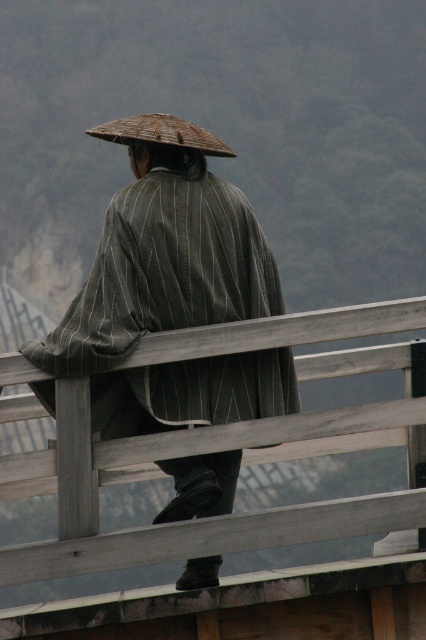
Question: Among these points, which one is nearest to the camera?

Choices:
 (A) (138, 134)
 (B) (143, 381)

Answer: (B)

Question: Does striped fabric kimono at center have a smaller size compared to brown woven straw hat at upper center?

Choices:
 (A) no
 (B) yes

Answer: (B)

Question: Does striped fabric kimono at center appear under brown woven straw hat at upper center?

Choices:
 (A) no
 (B) yes

Answer: (B)

Question: Is striped fabric kimono at center to the right of brown woven straw hat at upper center from the viewer's perspective?

Choices:
 (A) yes
 (B) no

Answer: (A)